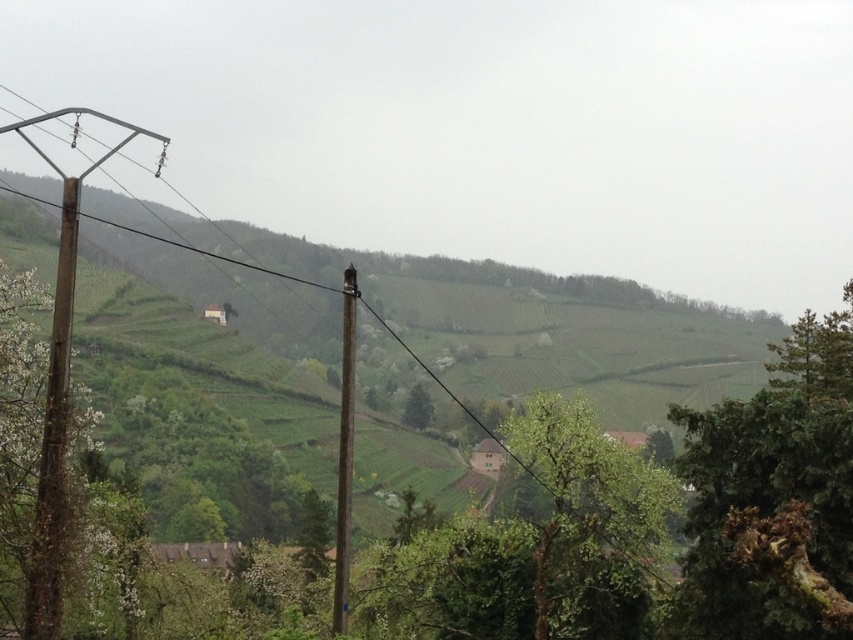
Question: Does green leafy tree at upper right come in front of green leafy tree at center?

Choices:
 (A) no
 (B) yes

Answer: (B)

Question: Estimate the real-world distances between objects in this image. Which object is farther from the brown wooden telegraph pole at center?

Choices:
 (A) green leafy tree at center
 (B) brown wooden telegraph pole at left
 (C) green leafy tree at upper right

Answer: (A)

Question: Is brown wooden telegraph pole at left closer to the viewer compared to brown wooden telegraph pole at center?

Choices:
 (A) yes
 (B) no

Answer: (A)

Question: Which point appears farthest from the camera in this image?

Choices:
 (A) (718, 413)
 (B) (41, 490)

Answer: (A)

Question: Estimate the real-world distances between objects in this image. Which object is farther from the green leafy tree at center?

Choices:
 (A) brown wooden telegraph pole at left
 (B) brown wooden telegraph pole at center
 (C) green leafy tree at upper right

Answer: (A)

Question: Does green leafy tree at upper right appear on the right side of brown wooden telegraph pole at center?

Choices:
 (A) yes
 (B) no

Answer: (A)